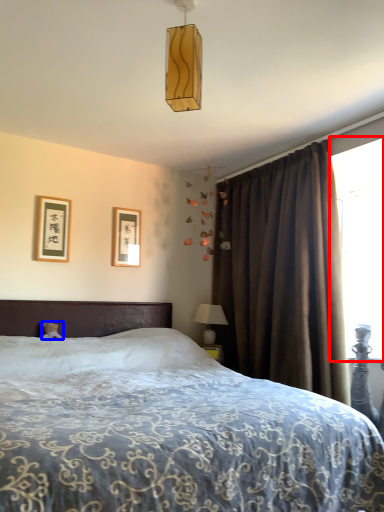
Question: Among these objects, which one is farthest to the camera, window screen (highlighted by a red box) or teddy bear (highlighted by a blue box)?

Choices:
 (A) window screen
 (B) teddy bear

Answer: (A)